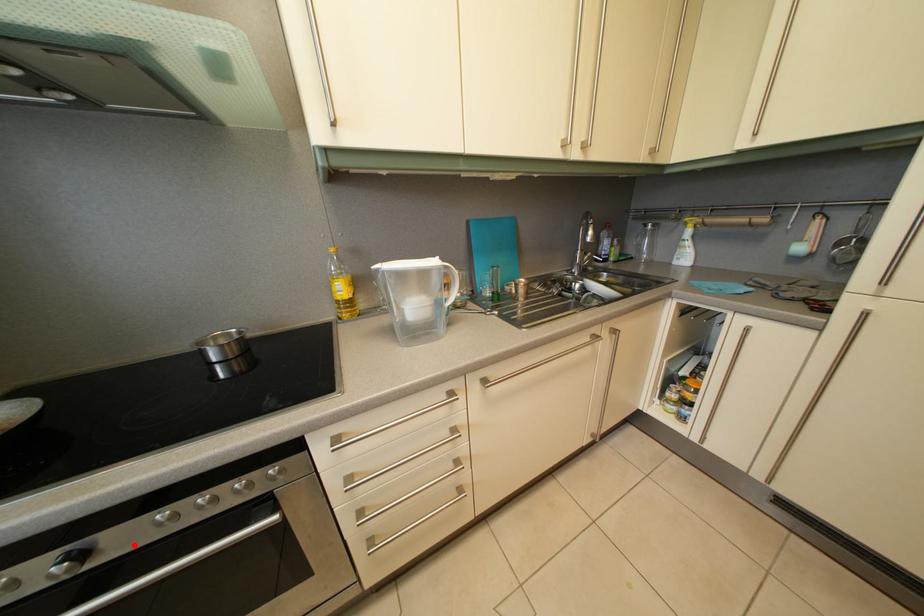
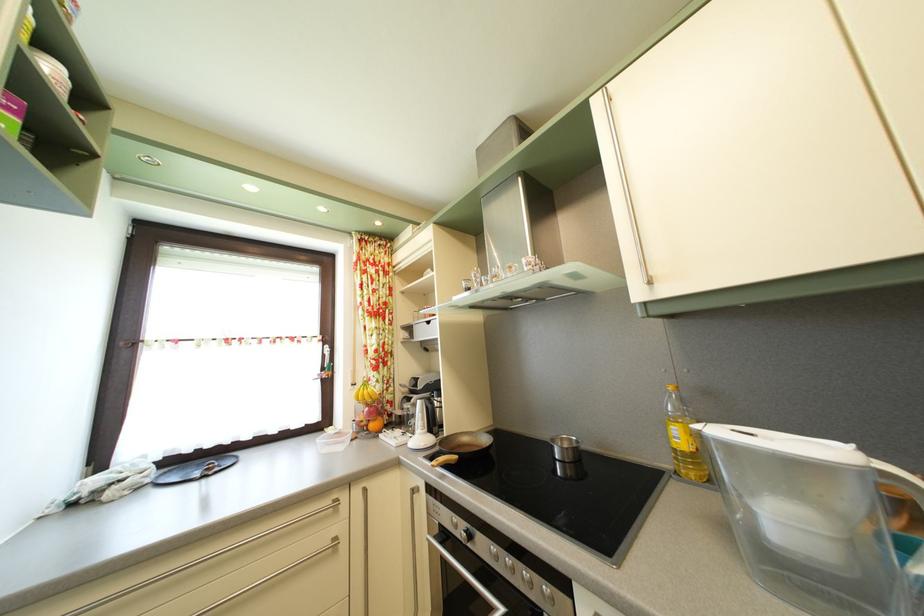
Question: A red point is marked in image1. In image2, is the corresponding 3D point closer to the camera or farther? Reply with the corresponding letter.

Choices:
 (A) The corresponding 3D point is closer.
 (B) The corresponding 3D point is farther.

Answer: (B)